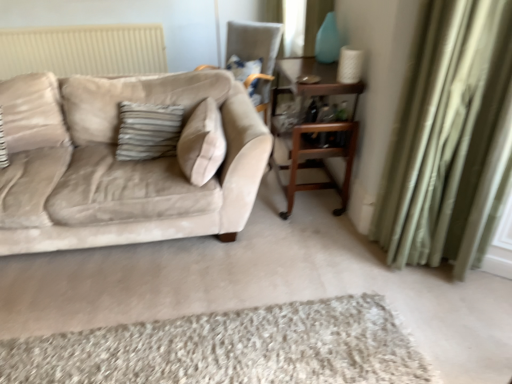
Question: Would you say green velvet curtain at right is a long distance from velvet beige chair at upper center?

Choices:
 (A) yes
 (B) no

Answer: (A)

Question: Considering the relative sizes of green velvet curtain at right and velvet beige chair at upper center in the image provided, is green velvet curtain at right taller than velvet beige chair at upper center?

Choices:
 (A) no
 (B) yes

Answer: (B)

Question: Considering the relative sizes of green velvet curtain at right and velvet beige chair at upper center in the image provided, is green velvet curtain at right smaller than velvet beige chair at upper center?

Choices:
 (A) no
 (B) yes

Answer: (B)

Question: From a real-world perspective, is green velvet curtain at right below velvet beige chair at upper center?

Choices:
 (A) no
 (B) yes

Answer: (A)

Question: Is green velvet curtain at right directly adjacent to velvet beige chair at upper center?

Choices:
 (A) no
 (B) yes

Answer: (A)

Question: From the image's perspective, is green velvet curtain at right above or below wooden table at center?

Choices:
 (A) above
 (B) below

Answer: (B)

Question: Would you say green velvet curtain at right is to the left or to the right of wooden table at center in the picture?

Choices:
 (A) left
 (B) right

Answer: (B)

Question: Which is correct: green velvet curtain at right is inside wooden table at center, or outside of it?

Choices:
 (A) outside
 (B) inside

Answer: (A)

Question: In terms of height, does green velvet curtain at right look taller or shorter compared to wooden table at center?

Choices:
 (A) short
 (B) tall

Answer: (B)

Question: Considering the positions of point (214, 192) and point (296, 57), is point (214, 192) closer or farther from the camera than point (296, 57)?

Choices:
 (A) closer
 (B) farther

Answer: (A)

Question: From a real-world perspective, is beige velvet couch at left above or below wooden table at center?

Choices:
 (A) below
 (B) above

Answer: (B)

Question: Is beige velvet couch at left in front of or behind wooden table at center in the image?

Choices:
 (A) front
 (B) behind

Answer: (A)

Question: Considering the positions of beige velvet couch at left and wooden table at center in the image, is beige velvet couch at left bigger or smaller than wooden table at center?

Choices:
 (A) big
 (B) small

Answer: (A)

Question: Is point (313, 370) positioned closer to the camera than point (199, 104)?

Choices:
 (A) farther
 (B) closer

Answer: (B)

Question: Considering the relative positions of shaggy beige rug at lower center and beige velvet couch at left in the image provided, is shaggy beige rug at lower center to the left or to the right of beige velvet couch at left?

Choices:
 (A) right
 (B) left

Answer: (A)